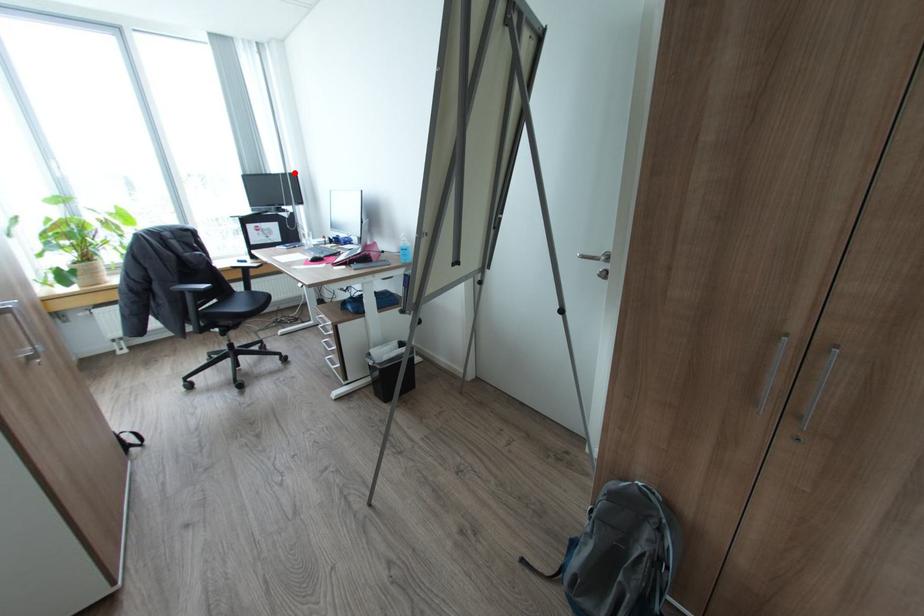
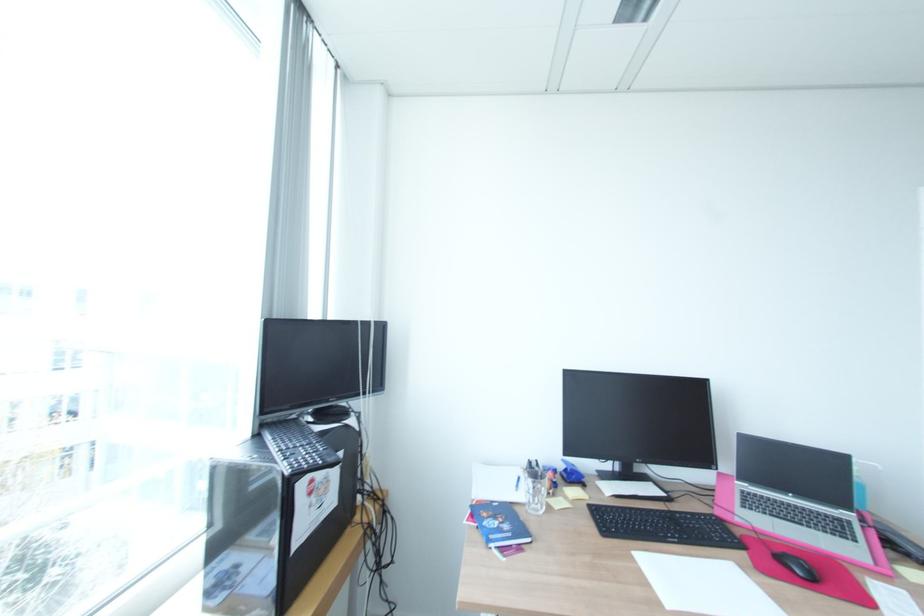
Find the pixel in the second image that matches the highlighted location in the first image.

(381, 321)